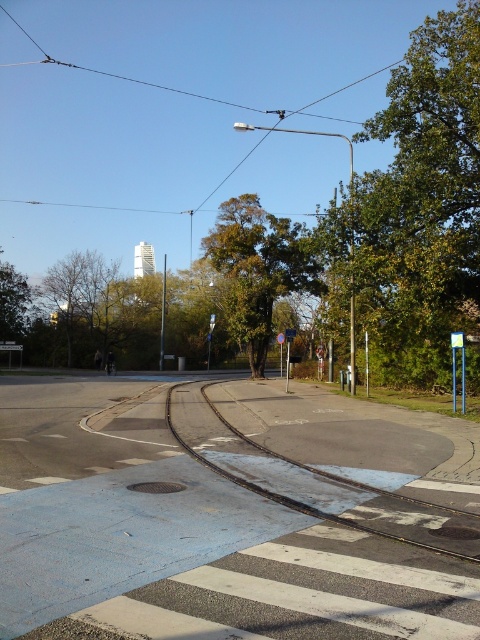
You are a city planner evaluating the urban street scene. You need to determine if the green leafy tree at upper center will block the view of the smooth asphalt train track at center for pedestrians waiting at the crossing. Based on their heights, will the tree obstruct the track?

The green leafy tree at upper center is taller than the smooth asphalt train track at center. Since the tree is taller, it could potentially block the view of the track for pedestrians waiting at the crossing.

You are a pedestrian standing at the pedestrian crossing and want to walk to the green leafy tree at left. However, there is a green leafy tree at center in your path. Which direction should you move to avoid walking through the tram tracks?

The green leafy tree at center is positioned over the green leafy tree at left, so you should move to the right side to avoid the tram tracks and reach the green leafy tree at left without crossing them.